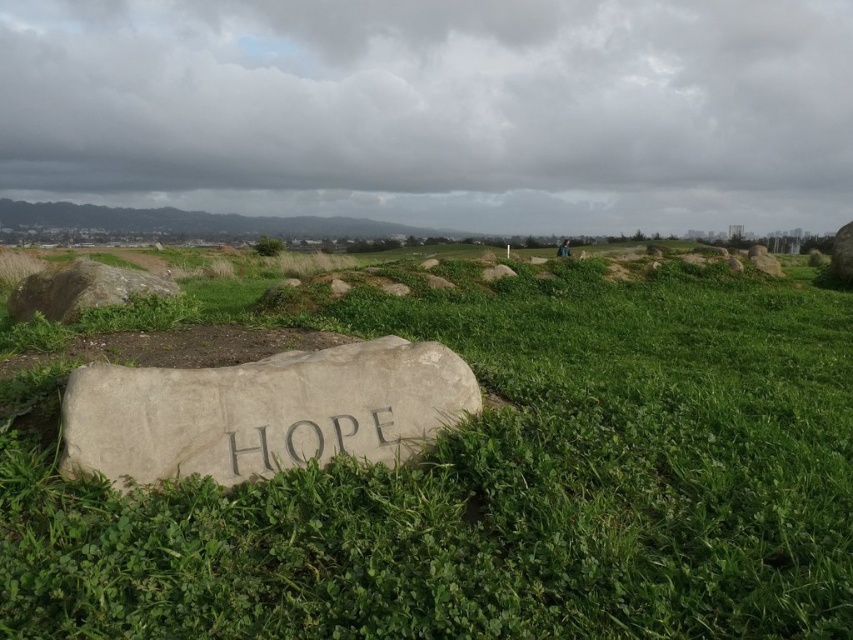
Between point (206, 372) and point (383, 406), which one is positioned behind?

The point (383, 406) is more distant.

Is point (440, 394) behind point (300, 426)?

Yes, it is behind point (300, 426).

In order to click on gray stone at center in this screenshot , I will do `click(262, 412)`.

Which is above, gray stone at center or gray stone at upper left?

gray stone at upper left

Can you confirm if gray stone at center is bigger than gray stone at upper left?

No.

This screenshot has height=640, width=853. I want to click on gray stone at center, so click(x=262, y=412).

Is green grassy at center shorter than gray stone at center?

No, green grassy at center is not shorter than gray stone at center.

Who is more forward, (579, 627) or (372, 403)?

Point (579, 627)

Image resolution: width=853 pixels, height=640 pixels. I want to click on green grassy at center, so click(x=503, y=486).